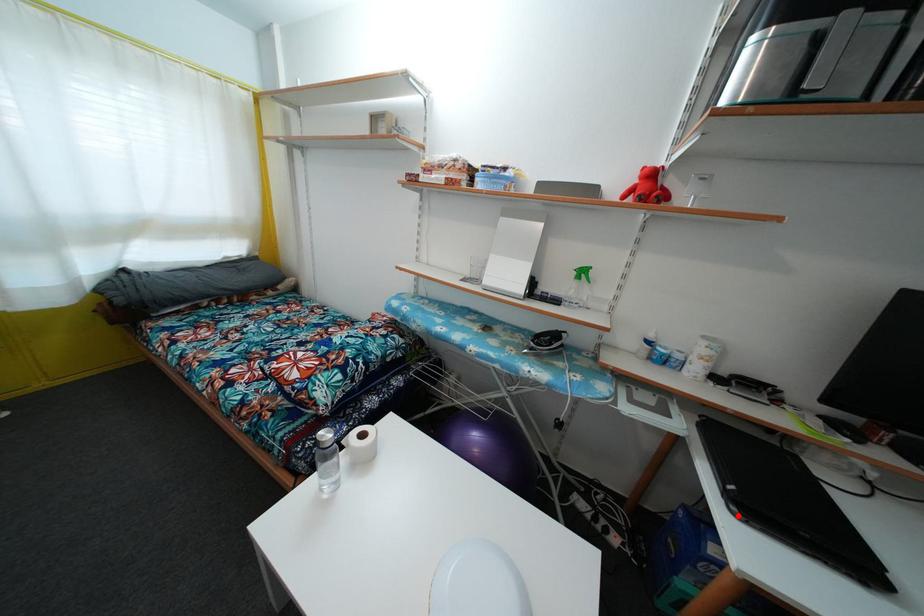
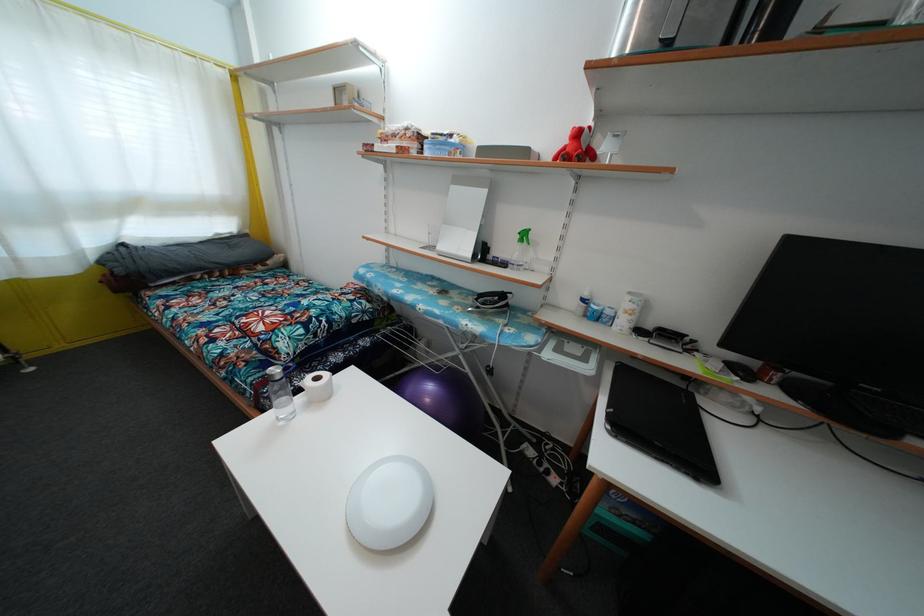
The point at the highlighted location is marked in the first image. Where is the corresponding point in the second image?

(613, 434)